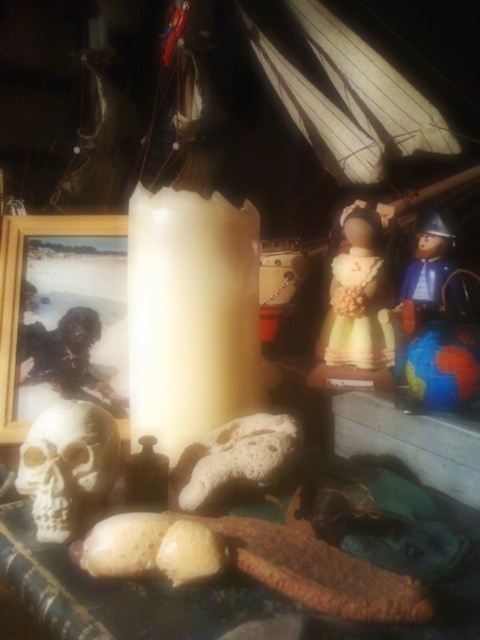
Question: Which point is farther to the camera?

Choices:
 (A) (334, 355)
 (B) (217, 385)
 (C) (90, 483)

Answer: (A)

Question: Which point appears closest to the camera in this image?

Choices:
 (A) (1, 419)
 (B) (330, 321)
 (C) (81, 413)
 (D) (220, 253)

Answer: (C)

Question: Which object is the closest to the white matte candle at center?

Choices:
 (A) white matte skull at lower left
 (B) matte yellow doll at center

Answer: (A)

Question: Considering the relative positions of white matte skull at lower left and wooden photo frame at left in the image provided, where is white matte skull at lower left located with respect to wooden photo frame at left?

Choices:
 (A) above
 (B) below

Answer: (B)

Question: Is white matte candle at center positioned before wooden photo frame at left?

Choices:
 (A) yes
 (B) no

Answer: (A)

Question: Does white matte candle at center have a lesser width compared to white matte skull at lower left?

Choices:
 (A) yes
 (B) no

Answer: (B)